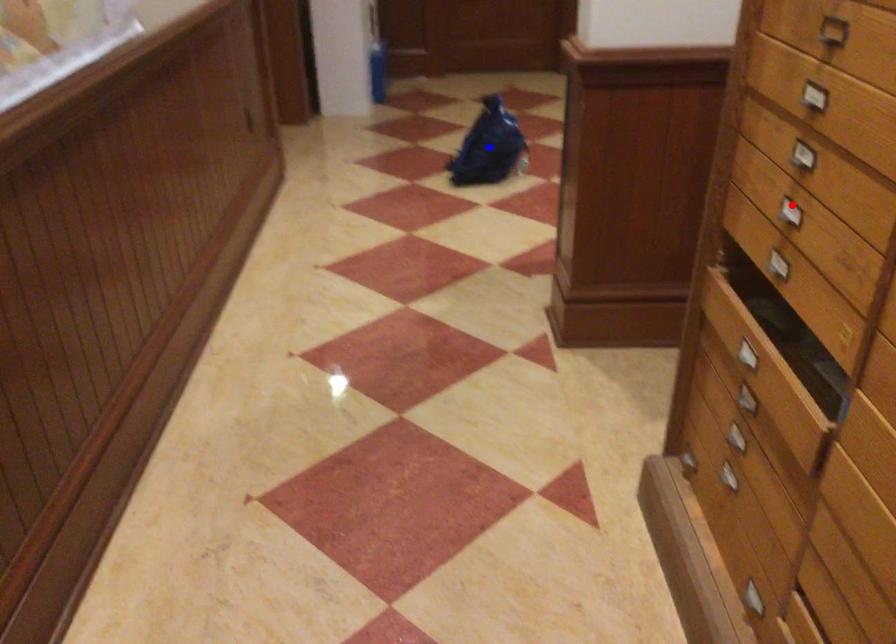
Question: Two points are marked on the image. Which point is closer to the camera?

Choices:
 (A) Blue point is closer.
 (B) Red point is closer.

Answer: (B)